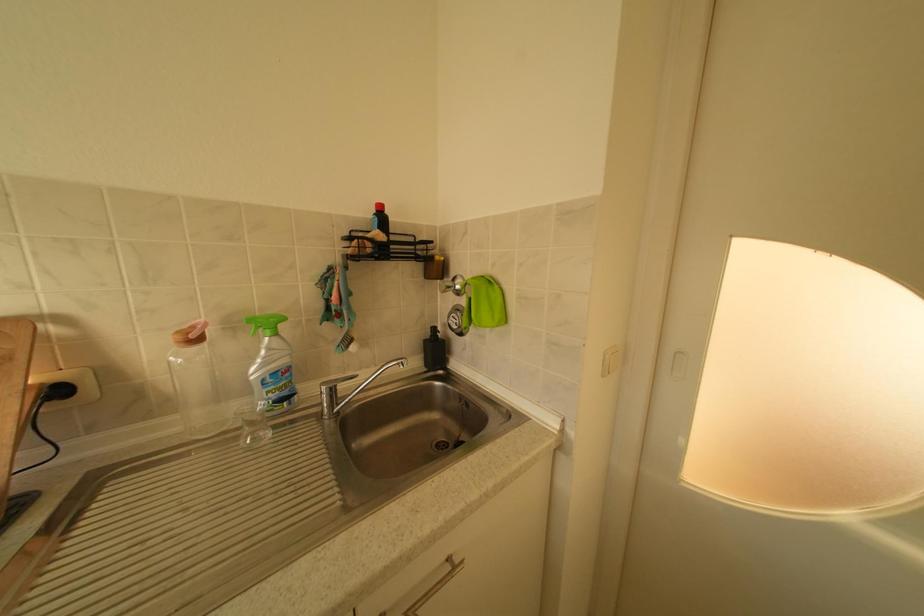
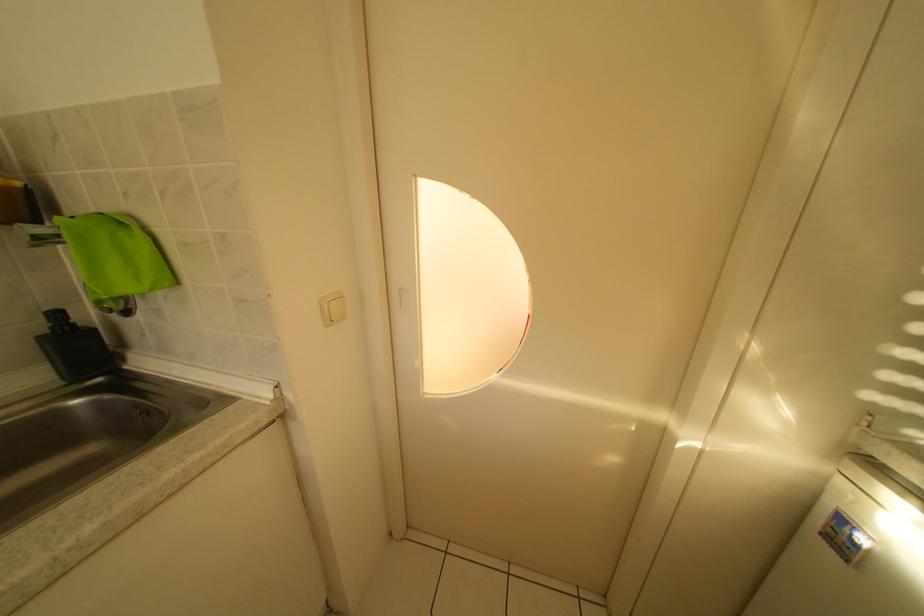
Question: Based on the continuous images, in which direction is the camera rotating? Reply with the corresponding letter.

Choices:
 (A) Left
 (B) Right
 (C) Up
 (D) Down

Answer: (B)